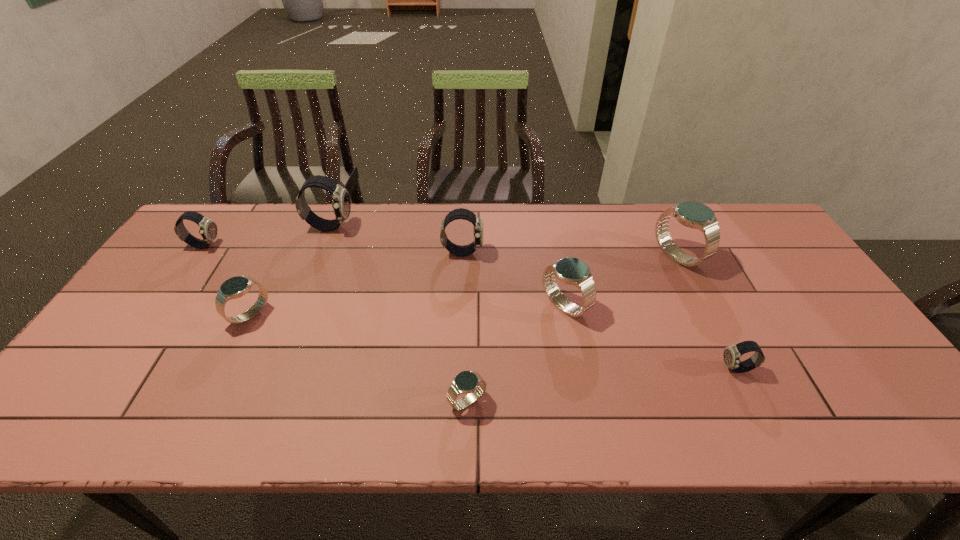
Where is `free point that satisfies the following two spatial constraints: 1. on the face of the rightmost blue watch; 2. on the right side of the second biggest dark watch`? free point that satisfies the following two spatial constraints: 1. on the face of the rightmost blue watch; 2. on the right side of the second biggest dark watch is located at coordinates (463, 256).

The image size is (960, 540). I want to click on vacant space that satisfies the following two spatial constraints: 1. on the back side of the nearest object; 2. on the face of the second biggest dark watch, so click(470, 252).

Where is `free space that satisfies the following two spatial constraints: 1. on the face of the second biggest dark watch; 2. on the right side of the second biggest blue watch`? The height and width of the screenshot is (540, 960). free space that satisfies the following two spatial constraints: 1. on the face of the second biggest dark watch; 2. on the right side of the second biggest blue watch is located at coordinates (461, 306).